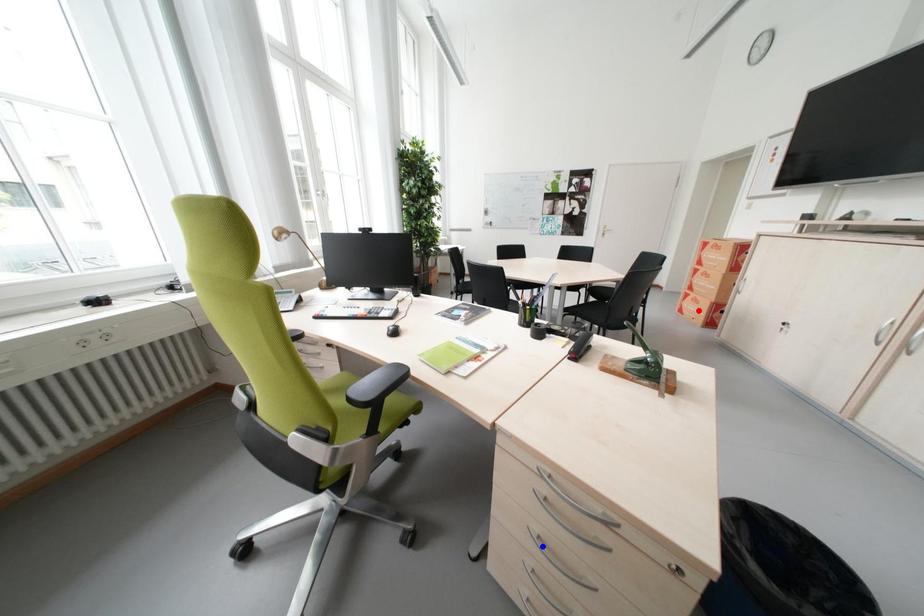
Question: Which of the two points in the image is closer to the camera?

Choices:
 (A) Blue point is closer.
 (B) Red point is closer.

Answer: (A)